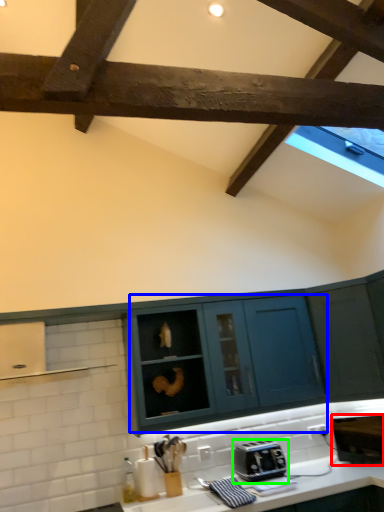
Question: Which object is positioned closest to appliance (highlighted by a red box)? Select from cabinetry (highlighted by a blue box) and toaster (highlighted by a green box).

Choices:
 (A) cabinetry
 (B) toaster

Answer: (B)